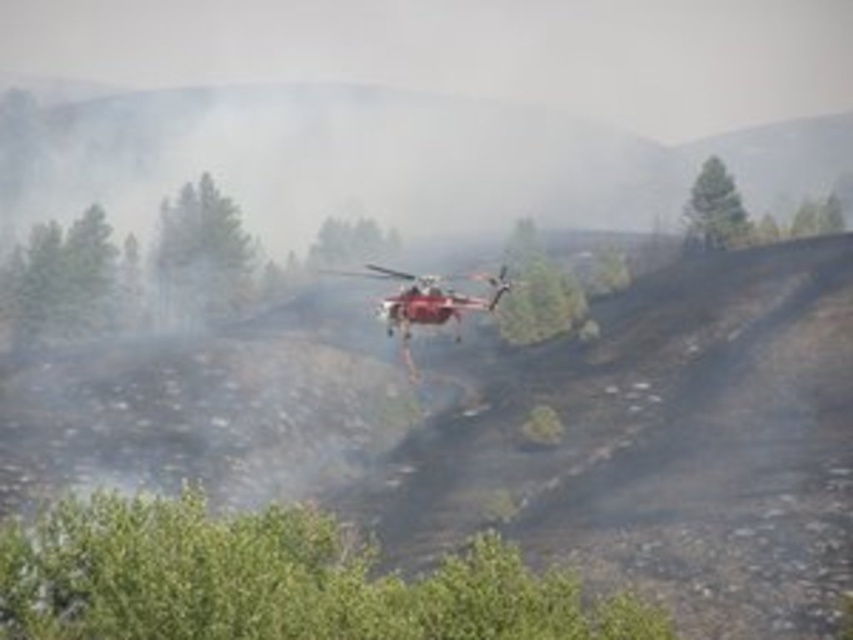
Who is positioned more to the right, green leafy tree at lower center or green matte tree at upper left?

green leafy tree at lower center

Does green leafy tree at lower center have a smaller size compared to green matte tree at upper left?

Incorrect, green leafy tree at lower center is not smaller in size than green matte tree at upper left.

Who is more forward, (x=334, y=563) or (x=213, y=184)?

Point (x=334, y=563) is more forward.

Where is `green leafy tree at lower center`? green leafy tree at lower center is located at coordinates (271, 580).

You are a GUI agent. You are given a task and a screenshot of the screen. Output one action in this format:
    pyautogui.click(x=<x>, y=<y>)
    Task: Click on the metallic red helicopter at center
    
    Given the screenshot: What is the action you would take?
    pyautogui.click(x=428, y=298)

Who is more distant from viewer, (x=387, y=316) or (x=697, y=228)?

Positioned behind is point (x=697, y=228).

Where is `metallic red helicopter at center`? The width and height of the screenshot is (853, 640). metallic red helicopter at center is located at coordinates point(428,298).

Who is more forward, (225,237) or (376,234)?

Positioned in front is point (225,237).

Can you confirm if green matte tree at upper left is shorter than green matte tree at center?

In fact, green matte tree at upper left may be taller than green matte tree at center.

Is point (209, 282) positioned before point (329, 221)?

Yes, point (209, 282) is in front of point (329, 221).

Where is `green matte tree at upper left`? The width and height of the screenshot is (853, 640). green matte tree at upper left is located at coordinates (200, 256).